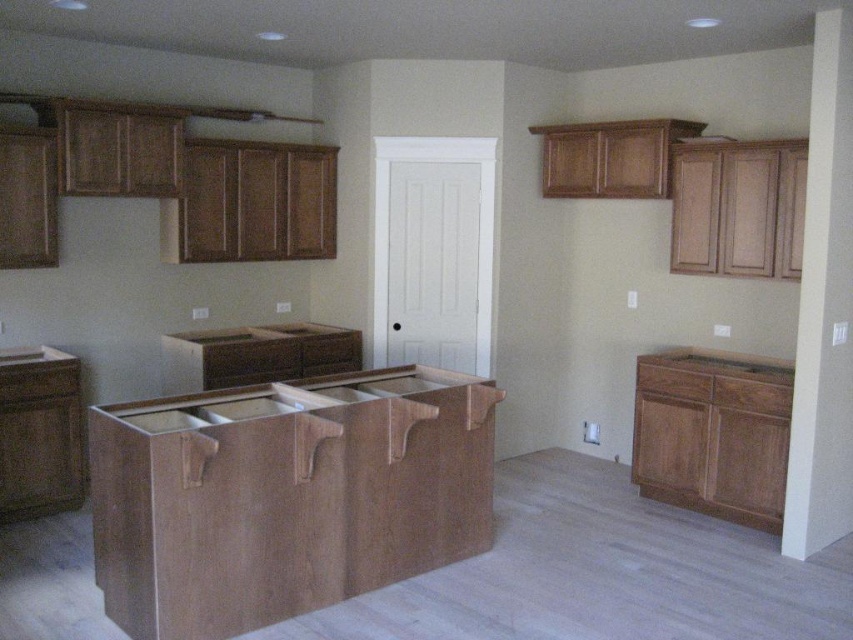
Is point (438, 394) less distant than point (338, 346)?

Yes, point (438, 394) is in front of point (338, 346).

Between natural wood counter at center and wooden at center, which one is positioned lower?

natural wood counter at center is lower down.

At what (x,y) coordinates should I click in order to perform the action: click on natural wood counter at center. Please return your answer as a coordinate pair (x, y). Looking at the image, I should click on (285, 496).

Is natural wood counter at center taller than wooden drawer at center?

Indeed, natural wood counter at center has a greater height compared to wooden drawer at center.

Who is taller, natural wood counter at center or wooden drawer at center?

natural wood counter at center

Between point (169, 467) and point (341, 337), which one is positioned in front?

Point (169, 467) is in front.

Find the location of a particular element. natural wood counter at center is located at coordinates (285, 496).

Is natural wood counter at center positioned before walnut wood drawer at right?

Yes.

Who is lower down, natural wood counter at center or walnut wood drawer at right?

natural wood counter at center

What do you see at coordinates (285, 496) in the screenshot? I see `natural wood counter at center` at bounding box center [285, 496].

The image size is (853, 640). In order to click on natural wood counter at center in this screenshot , I will do `click(285, 496)`.